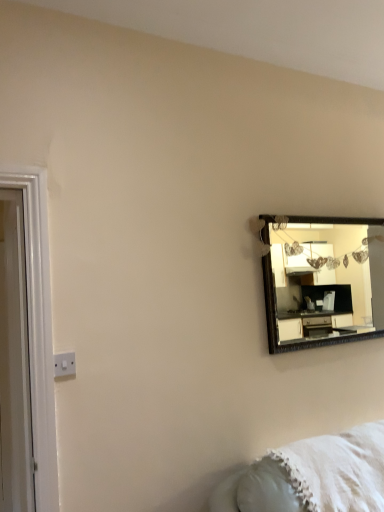
Question: From the image's perspective, is white plastic switch at lower left above white glossy door at left?

Choices:
 (A) no
 (B) yes

Answer: (A)

Question: Is white plastic switch at lower left smaller than white glossy door at left?

Choices:
 (A) yes
 (B) no

Answer: (A)

Question: From a real-world perspective, is white plastic switch at lower left physically below white glossy door at left?

Choices:
 (A) no
 (B) yes

Answer: (B)

Question: Is white plastic switch at lower left behind white glossy door at left?

Choices:
 (A) yes
 (B) no

Answer: (A)

Question: Does white plastic switch at lower left appear on the left side of white glossy door at left?

Choices:
 (A) yes
 (B) no

Answer: (B)

Question: From a real-world perspective, is white fluffy blanket at lower right positioned above or below wooden-framed mirror at upper right?

Choices:
 (A) below
 (B) above

Answer: (A)

Question: From the image's perspective, is white fluffy blanket at lower right positioned above or below wooden-framed mirror at upper right?

Choices:
 (A) below
 (B) above

Answer: (A)

Question: Considering the positions of white fluffy blanket at lower right and wooden-framed mirror at upper right in the image, is white fluffy blanket at lower right taller or shorter than wooden-framed mirror at upper right?

Choices:
 (A) tall
 (B) short

Answer: (B)

Question: Relative to wooden-framed mirror at upper right, is white fluffy blanket at lower right in front or behind?

Choices:
 (A) front
 (B) behind

Answer: (A)

Question: Is white plastic switch at lower left taller or shorter than wooden-framed mirror at upper right?

Choices:
 (A) short
 (B) tall

Answer: (A)

Question: From the image's perspective, is white plastic switch at lower left positioned above or below wooden-framed mirror at upper right?

Choices:
 (A) below
 (B) above

Answer: (A)

Question: In terms of size, does white plastic switch at lower left appear bigger or smaller than wooden-framed mirror at upper right?

Choices:
 (A) big
 (B) small

Answer: (B)

Question: In the image, is white plastic switch at lower left on the left side or the right side of wooden-framed mirror at upper right?

Choices:
 (A) right
 (B) left

Answer: (B)

Question: Is wooden-framed mirror at upper right bigger or smaller than white fluffy blanket at lower right?

Choices:
 (A) big
 (B) small

Answer: (B)

Question: Looking at their shapes, would you say wooden-framed mirror at upper right is wider or thinner than white fluffy blanket at lower right?

Choices:
 (A) thin
 (B) wide

Answer: (A)